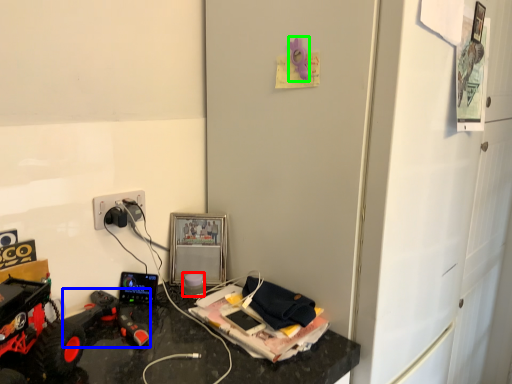
Question: Estimate the real-world distances between objects in this image. Which object is farther from toy (highlighted by a red box), toy (highlighted by a blue box) or toy (highlighted by a green box)?

Choices:
 (A) toy
 (B) toy

Answer: (B)